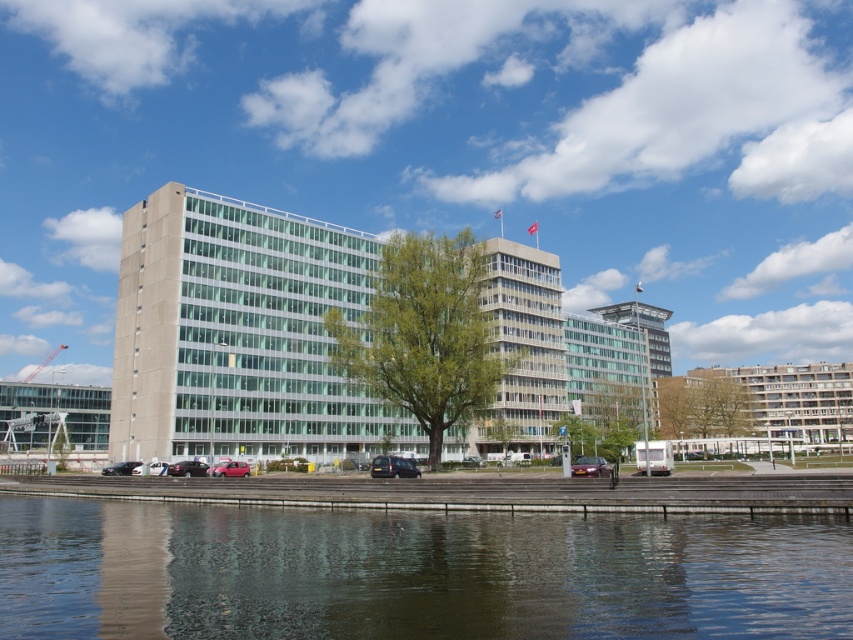
You are a photographer planning to take a picture of the modern multi story building along the waterfront. You notice two cars parked at the lower left corner of your frame. Which car, the shiny silver car at lower left or the matte black car at lower left, would appear shorter in your photo?

The shiny silver car at lower left would appear shorter in the photo because it is not as tall as the matte black car at lower left.

You are a photographer planning to capture a symmetrical shot of the building and its reflection on the water. You have two cars in the scene, a dark gray matte car at center and a matte red car at lower left. Which car should you position closer to the building to maintain symmetry in your composition?

To maintain symmetry, the dark gray matte car at center should be positioned closer to the building because it is larger than the matte red car at lower left, balancing the composition.

You are a pedestrian standing on the sidewalk in front of the building. You see two cars parked at the lower left of the image. Which car is closer to you, the shiny silver car at lower left or the matte black car at lower left?

The shiny silver car at lower left is closer to you because it is positioned in front of the matte black car at lower left.